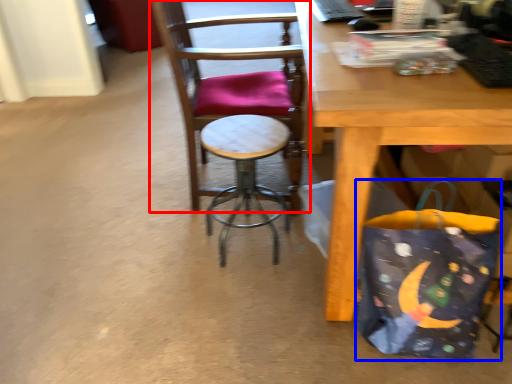
Question: Which object is further to the camera taking this photo, chair (highlighted by a red box) or grocery bag (highlighted by a blue box)?

Choices:
 (A) chair
 (B) grocery bag

Answer: (A)